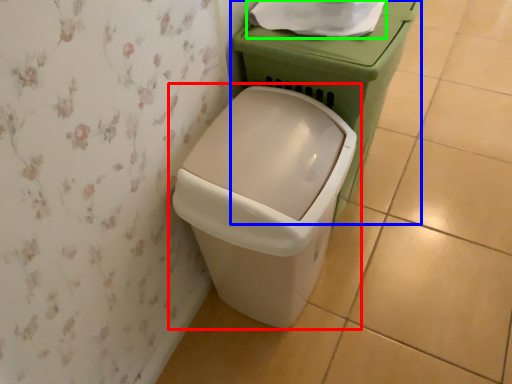
Question: Which object is positioned closest to waste container (highlighted by a red box)? Select from porcelain (highlighted by a blue box) and toilet paper (highlighted by a green box).

Choices:
 (A) porcelain
 (B) toilet paper

Answer: (A)